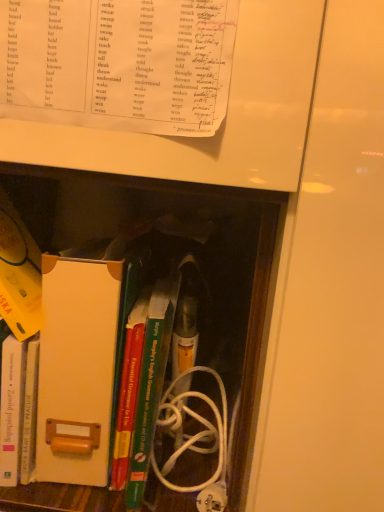
Question: Considering the relative positions of green matte book at center, the 4th book in the bottom-to-top sequence, and white paper at upper center, the 5th book positioned from the bottom, in the image provided, is green matte book at center, the 4th book in the bottom-to-top sequence, to the left or to the right of white paper at upper center, the 5th book positioned from the bottom,?

Choices:
 (A) right
 (B) left

Answer: (A)

Question: From a real-world perspective, relative to white paper at upper center, the 1th book positioned from the top, is green matte book at center, the 4th book in the bottom-to-top sequence, vertically above or below?

Choices:
 (A) below
 (B) above

Answer: (A)

Question: Which object is the closest to the green hardcover book at center, the fourth book when ordered from top to bottom?

Choices:
 (A) hardcover book at left, which is the 5th book from top to bottom
 (B) green matte book at center, which appears as the 2th book when viewed from the top
 (C) white paper at upper center, the 1th book positioned from the top
 (D) white cardboard file at center
 (E) hardcover book at center, which is the 3th book in top-to-bottom order

Answer: (B)

Question: Which of these objects is positioned closest to the green matte book at center, which appears as the 2th book when viewed from the top?

Choices:
 (A) white paper at upper center, the 5th book positioned from the bottom
 (B) green hardcover book at center, the fourth book when ordered from top to bottom
 (C) hardcover book at center, which is the third book from bottom to top
 (D) hardcover book at left, which is the 5th book from top to bottom
 (E) white cardboard file at center

Answer: (B)